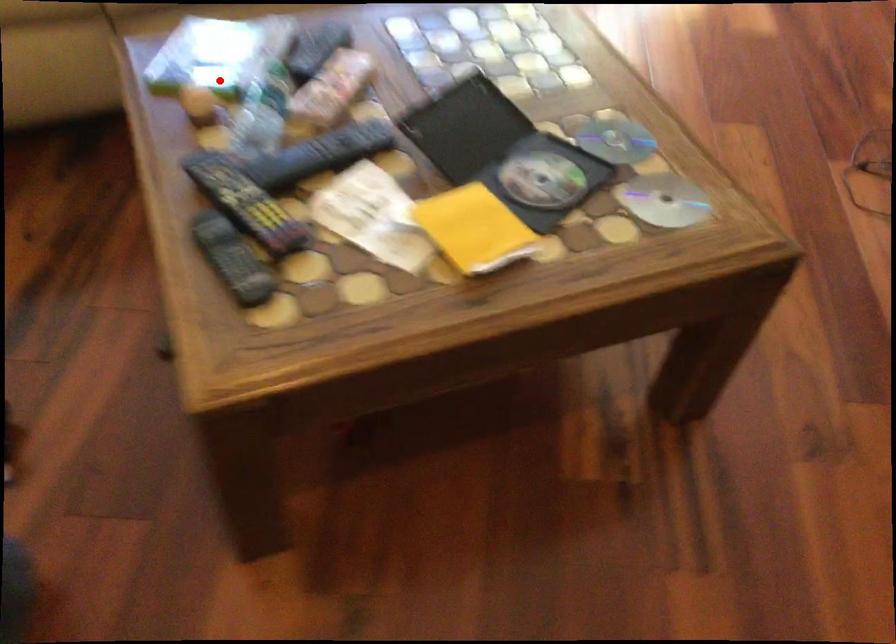
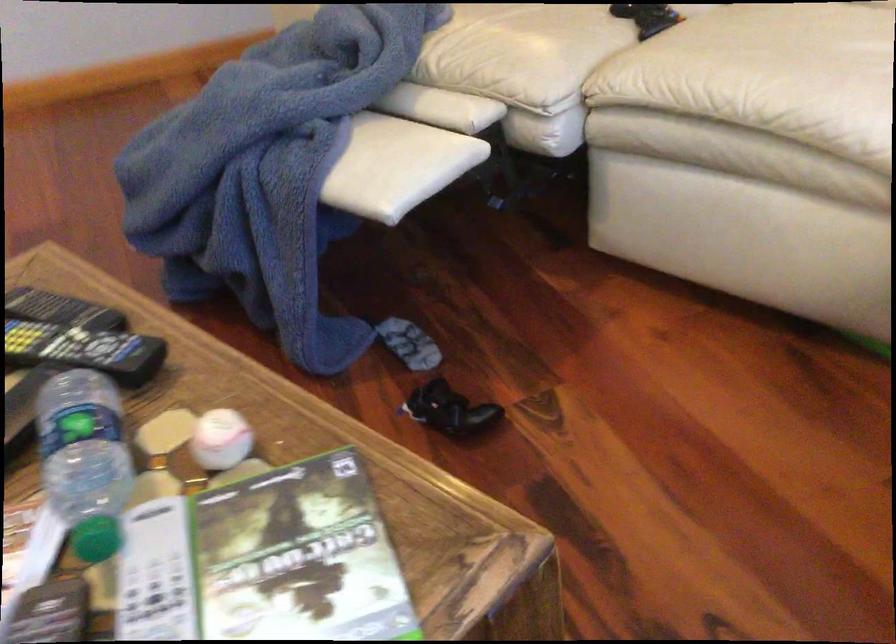
Question: I am providing you with two images of the same scene from different viewpoints. Image1 has a red point marked. In image2, the corresponding 3D location appears at what relative position? Reply with the corresponding letter.

Choices:
 (A) Closer
 (B) Farther

Answer: (A)